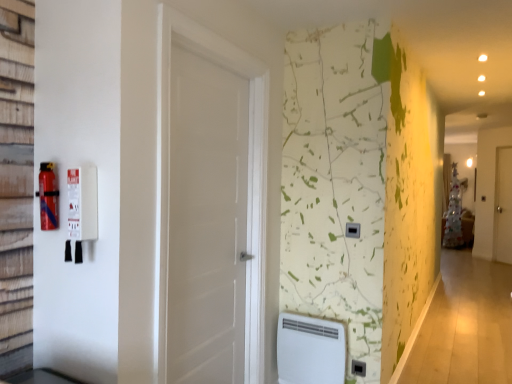
Describe the element at coordinates (310, 350) in the screenshot. I see `white plastic water heater at lower center` at that location.

What do you see at coordinates (358, 368) in the screenshot? I see `black plastic electric outlet at center` at bounding box center [358, 368].

The height and width of the screenshot is (384, 512). What do you see at coordinates (207, 222) in the screenshot? I see `white matte door at center, acting as the 1th door starting from the left` at bounding box center [207, 222].

Identify the location of black plastic/light switch at center-right. Image resolution: width=512 pixels, height=384 pixels. (352, 230).

Considering the relative sizes of black plastic electric outlet at center and white plastic water heater at lower center in the image provided, is black plastic electric outlet at center shorter than white plastic water heater at lower center?

Indeed, black plastic electric outlet at center has a lesser height compared to white plastic water heater at lower center.

Is black plastic electric outlet at center aimed at white plastic water heater at lower center?

No, black plastic electric outlet at center does not turn towards white plastic water heater at lower center.

From a real-world perspective, which is physically below, black plastic electric outlet at center or white plastic water heater at lower center?

black plastic electric outlet at center.

Is black plastic/light switch at center-right closer to camera compared to white matte door at center, the first door when ordered from front to back?

No, black plastic/light switch at center-right is further to the viewer.

Can you tell me how much black plastic/light switch at center-right and white matte door at center, the first door when ordered from front to back, differ in facing direction?

91.3 degrees.

Between black plastic/light switch at center-right and white matte door at center, the first door when ordered from front to back, which one has larger width?

white matte door at center, the first door when ordered from front to back, is wider.

From a real-world perspective, between black plastic/light switch at center-right and white matte door at center, the 2th door positioned from the right, who is vertically lower?

In real-world perspective, white matte door at center, the 2th door positioned from the right, is lower.

Consider the image. From the image's perspective, is white wooden door at right, which is counted as the 1th door, starting from the right, above or below white matte door at center, the 2th door positioned from the right?

From the image's perspective, white wooden door at right, which is counted as the 1th door, starting from the right, appears below white matte door at center, the 2th door positioned from the right.

Considering the relative positions of white wooden door at right, which is counted as the 1th door, starting from the right, and white matte door at center, acting as the 1th door starting from the left, in the image provided, is white wooden door at right, which is counted as the 1th door, starting from the right, behind white matte door at center, acting as the 1th door starting from the left,?

That is True.

From a real-world perspective, is white wooden door at right, which is counted as the 1th door, starting from the right, over white matte door at center, acting as the 1th door starting from the left?

Actually, white wooden door at right, which is counted as the 1th door, starting from the right, is physically below white matte door at center, acting as the 1th door starting from the left, in the real world.

From the image's perspective, which one is positioned lower, black plastic/light switch at center-right or white plastic water heater at lower center?

From the image's view, white plastic water heater at lower center is below.

Are black plastic/light switch at center-right and white plastic water heater at lower center located far from each other?

No, black plastic/light switch at center-right is in close proximity to white plastic water heater at lower center.

Which object is positioned more to the right, black plastic/light switch at center-right or white plastic water heater at lower center?

black plastic/light switch at center-right is more to the right.

Considering their positions, is white matte door at center, acting as the 1th door starting from the left, located in front of or behind white plastic water heater at lower center?

Clearly, white matte door at center, acting as the 1th door starting from the left, is in front of white plastic water heater at lower center.

Is white matte door at center, the 2th door positioned from the right, directly adjacent to white plastic water heater at lower center?

No, white matte door at center, the 2th door positioned from the right, is not making contact with white plastic water heater at lower center.

Are black plastic/light switch at center-right and white wooden door at right, which is counted as the 1th door, starting from the right, beside each other?

black plastic/light switch at center-right and white wooden door at right, which is counted as the 1th door, starting from the right, are not in contact.

Considering the sizes of objects black plastic/light switch at center-right and white wooden door at right, the second door in the left-to-right sequence, in the image provided, who is bigger, black plastic/light switch at center-right or white wooden door at right, the second door in the left-to-right sequence,?

Bigger between the two is white wooden door at right, the second door in the left-to-right sequence.

In the scene shown: Is black plastic/light switch at center-right turned away from white wooden door at right, which is counted as the 1th door, starting from the right?

Yes, white wooden door at right, which is counted as the 1th door, starting from the right, is at the back of black plastic/light switch at center-right.

Can we say white wooden door at right, the second door in the left-to-right sequence, lies outside red matte fire extinguisher at left?

That's correct, white wooden door at right, the second door in the left-to-right sequence, is outside of red matte fire extinguisher at left.

Which object is positioned more to the left, white wooden door at right, marked as the 2th door in a front-to-back arrangement, or red matte fire extinguisher at left?

From the viewer's perspective, red matte fire extinguisher at left appears more on the left side.

Is point (508, 254) positioned behind point (52, 229)?

Yes, it is behind point (52, 229).

At what (x,y) coordinates should I click in order to perform the action: click on water heater located above the black plastic electric outlet at center (from a real-world perspective). Please return your answer as a coordinate pair (x, y). The width and height of the screenshot is (512, 384). Looking at the image, I should click on (310, 350).

This screenshot has width=512, height=384. There is a black plastic/light switch at center-right. In order to click on the 1st door below it (from the image's perspective) in this screenshot , I will do `click(207, 222)`.

From the image, which object appears to be farther from white matte door at center, the 2th door positioned from the right, black plastic/light switch at center-right or red matte fire extinguisher at left?

black plastic/light switch at center-right lies further to white matte door at center, the 2th door positioned from the right, than the other object.

Which object lies nearer to the anchor point black plastic electric outlet at center, black plastic/light switch at center-right or white plastic water heater at lower center?

Based on the image, white plastic water heater at lower center appears to be nearer to black plastic electric outlet at center.

Estimate the real-world distances between objects in this image. Which object is closer to white matte door at center, acting as the 1th door starting from the left, white plastic water heater at lower center or black plastic electric outlet at center?

white plastic water heater at lower center.

From the image, which object appears to be nearer to white plastic water heater at lower center, white wooden door at right, which is counted as the 1th door, starting from the right, or black plastic/light switch at center-right?

black plastic/light switch at center-right.

Considering their positions, is red matte fire extinguisher at left positioned closer to black plastic electric outlet at center than white wooden door at right, which is counted as the 1th door, starting from the right?

Among the two, red matte fire extinguisher at left is located nearer to black plastic electric outlet at center.

Estimate the real-world distances between objects in this image. Which object is closer to white wooden door at right, which is counted as the 1th door, starting from the right, black plastic electric outlet at center or white plastic water heater at lower center?

black plastic electric outlet at center is positioned closer to the anchor white wooden door at right, which is counted as the 1th door, starting from the right.

Estimate the real-world distances between objects in this image. Which object is further from white matte door at center, the 2th door positioned from the right, black plastic electric outlet at center or black plastic/light switch at center-right?

black plastic electric outlet at center lies further to white matte door at center, the 2th door positioned from the right, than the other object.

Estimate the real-world distances between objects in this image. Which object is closer to black plastic electric outlet at center, white wooden door at right, marked as the 2th door in a front-to-back arrangement, or red matte fire extinguisher at left?

The object closer to black plastic electric outlet at center is red matte fire extinguisher at left.

Find the location of `light switch between white matte door at center, marked as the second door in a back-to-front arrangement, and white wooden door at right, marked as the 2th door in a front-to-back arrangement, in the front-back direction`. light switch between white matte door at center, marked as the second door in a back-to-front arrangement, and white wooden door at right, marked as the 2th door in a front-to-back arrangement, in the front-back direction is located at coordinates (352, 230).

Identify the location of water heater between white matte door at center, acting as the 1th door starting from the left, and black plastic electric outlet at center vertically. This screenshot has width=512, height=384. (310, 350).

You are a GUI agent. You are given a task and a screenshot of the screen. Output one action in this format:
    pyautogui.click(x=<x>, y=<y>)
    Task: Click on the water heater between white matte door at center, the first door when ordered from front to back, and white wooden door at right, marked as the 2th door in a front-to-back arrangement, in the front-back direction
    The height and width of the screenshot is (384, 512).
    Given the screenshot: What is the action you would take?
    pyautogui.click(x=310, y=350)

At what (x,y) coordinates should I click in order to perform the action: click on door between red matte fire extinguisher at left and white plastic water heater at lower center from left to right. Please return your answer as a coordinate pair (x, y). Looking at the image, I should click on 207,222.